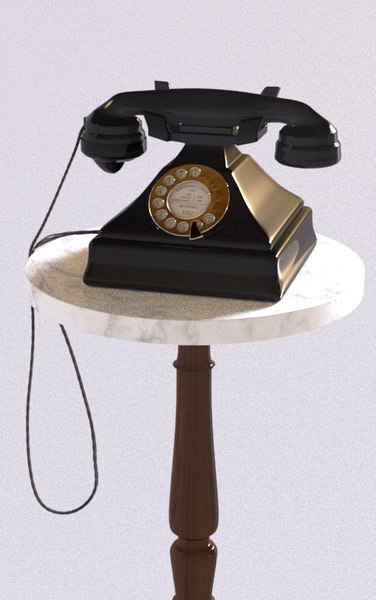
Identify the location of phone cord. (75, 365).